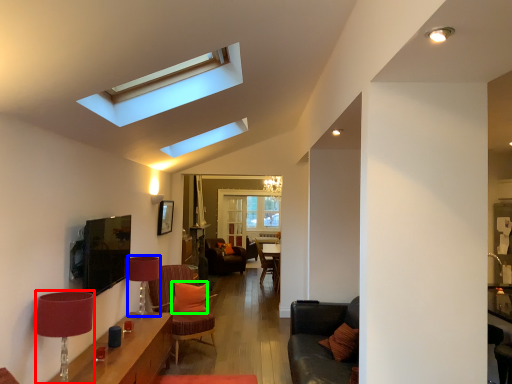
Question: Considering the real-world distances, which object is closest to lamp (highlighted by a red box)? lamp (highlighted by a blue box) or pillow (highlighted by a green box).

Choices:
 (A) lamp
 (B) pillow

Answer: (A)